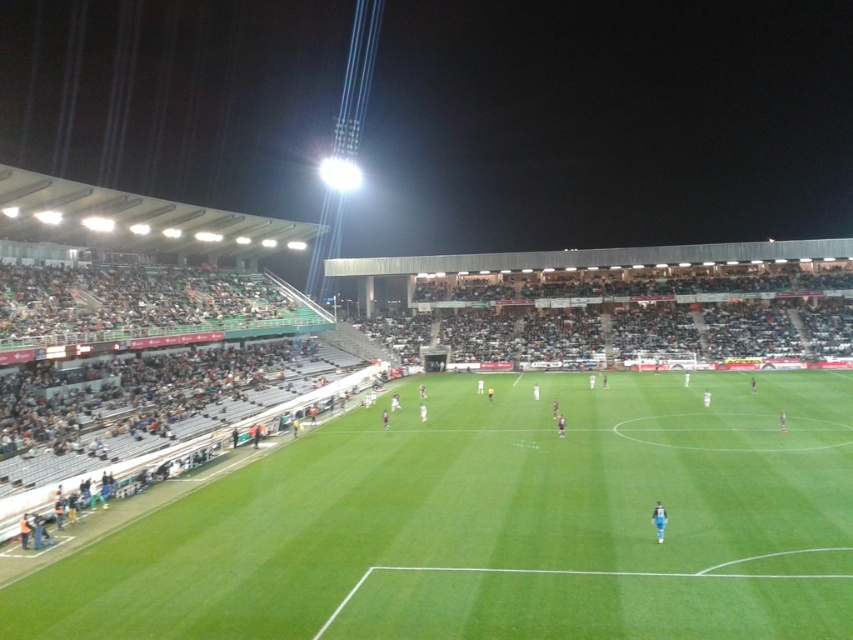
You are a drone operator trying to capture aerial footage of the nighttime soccer match. You notice the green grass football field at center and the blue fabric person at center in your camera view. Which object should you adjust your drone to focus on if you want to capture the player first?

The blue fabric person at center is above the green grass football field at center, so you should focus on the blue fabric person at center first to capture the player.

You are a photographer planning to take a wide shot of the nighttime soccer match. The green grass football field at center and the blue fabric person at center are both in your frame. Based on their sizes, which object will appear larger in the photo?

The green grass football field at center will appear larger in the photo because its width surpasses that of the blue fabric person at center.